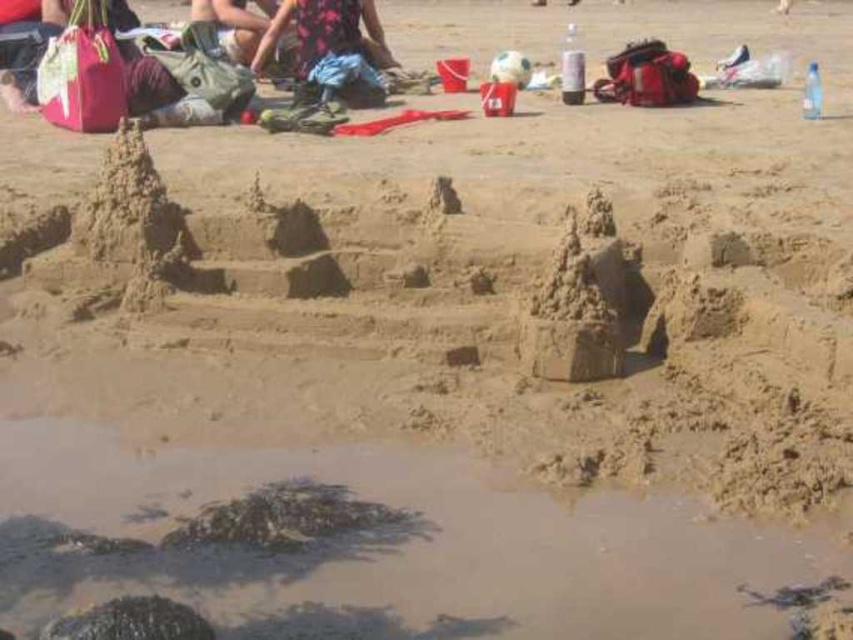
You are a photographer at the beach and want to capture both the floral dress at center and the green fabric bag at upper left in the same frame. Which object should you focus on first to ensure both are in the shot?

You should focus on the floral dress at center first because it is larger than the green fabric bag at upper left, so centering it will help include both in the frame.

You are a photographer trying to capture a shot of the sandcastles without including the people in the background. You notice the floral dress at center and the green fabric bag at upper left. Which object should you move your camera towards to avoid framing the people?

To avoid framing the people, move the camera towards the green fabric bag at upper left since the floral dress at center is positioned to the right of it, which might still include the background people in the frame.

You are a photographer trying to capture a shot of the two items mentioned. Given that your camera has a minimum focus distance of 24 inches, will you be able to focus on both the floral dress at center and the green fabric bag at upper left simultaneously?

The floral dress at center is 24.32 inches from the green fabric bag at upper left. Since the distance between them is just over 24 inches, your camera can focus on both items as the minimum focus distance is met.